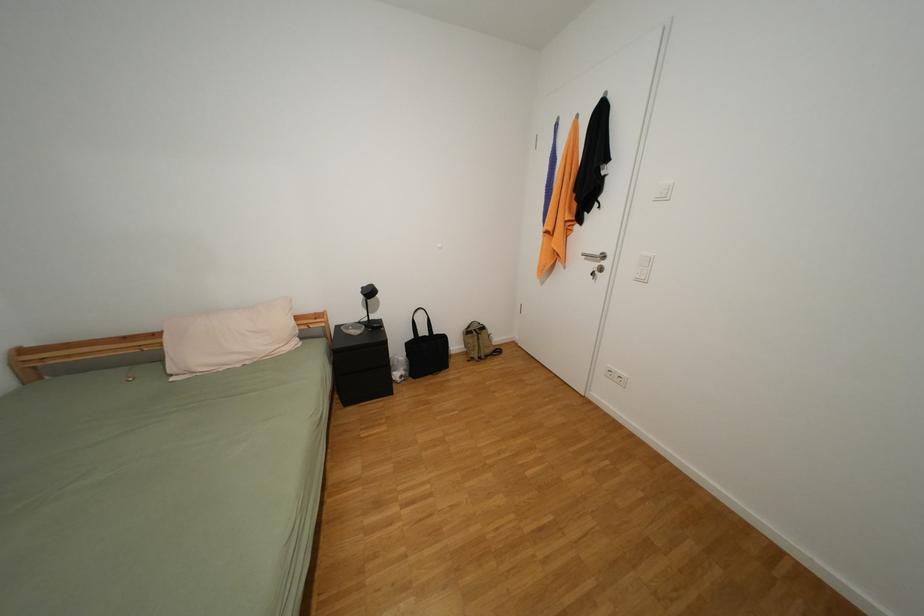
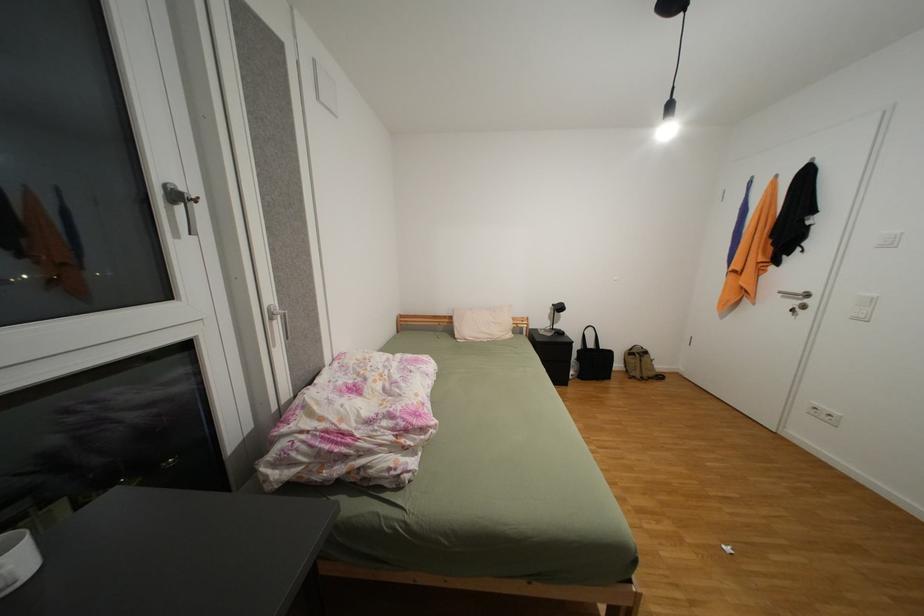
What movement of the cameraman would produce the second image?

The cameraman walked toward left, backward.